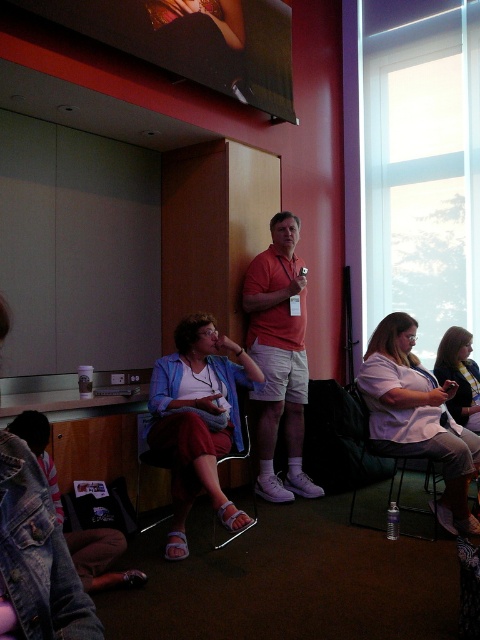
You are organizing a photo shoot and need to arrange two models wearing the matte orange shirt at center and the light purple shirt at center. Based on their current positions in the scene, which model should you place on the left side of the photo to ensure their shirts are visible without overlapping?

The matte orange shirt at center is thinner than the light purple shirt at center, so placing the model in the matte orange shirt at center on the left side would prevent overlapping since it has a narrower width.

You are standing in the conference room and want to move from point A to point B. Point A is at coordinates point (149,387) and point B is at coordinates point (290,248). Which point is closer to the large screen at the front?

Point (149,387) is in front of point (290,248), so it is closer to the large screen at the front.